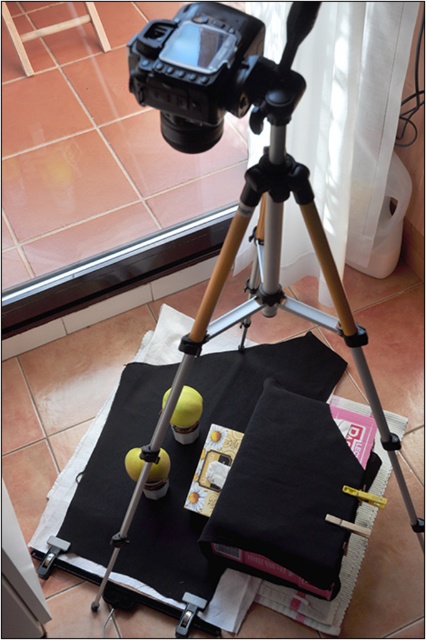
Which of these two, black matte cloth at center or wooden stool at upper left, stands shorter?

With less height is wooden stool at upper left.

Is black matte cloth at center bigger than wooden stool at upper left?

Yes.

Who is more distant from viewer, (x=342, y=435) or (x=106, y=51)?

Point (x=106, y=51)

The height and width of the screenshot is (640, 426). What are the coordinates of `black matte cloth at center` in the screenshot? It's located at (287, 496).